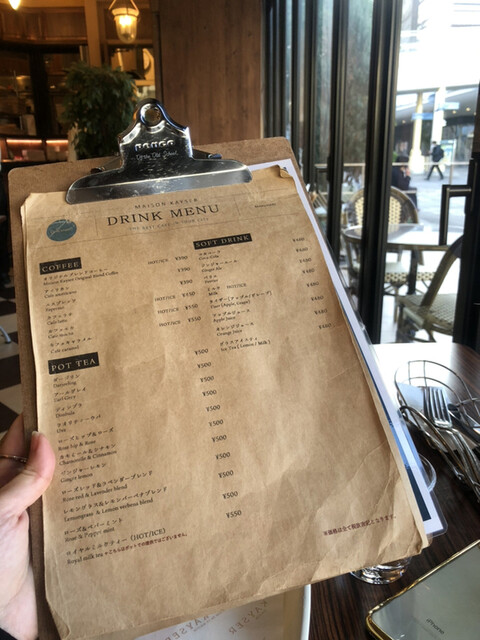
The image size is (480, 640). Identify the location of round table. (422, 239).